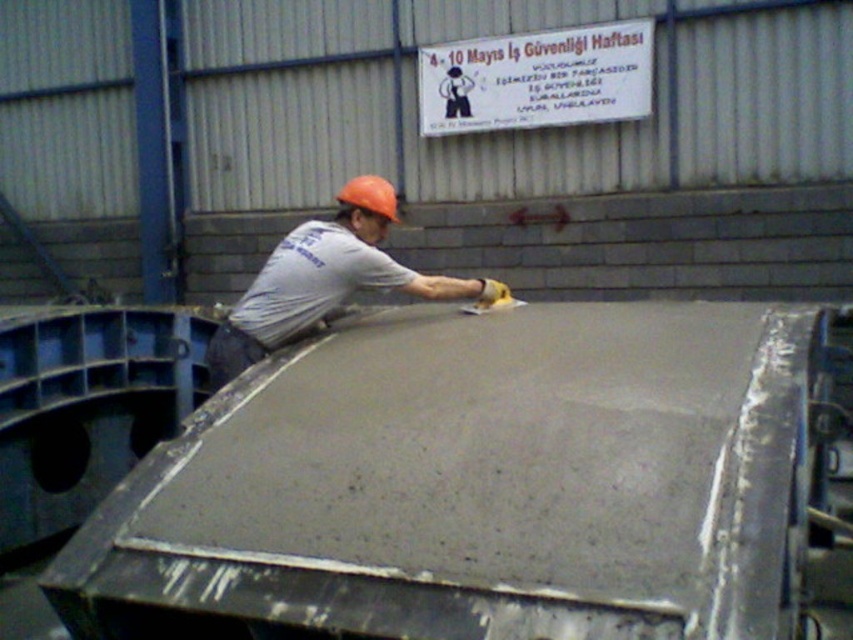
This screenshot has height=640, width=853. What do you see at coordinates (486, 483) in the screenshot?
I see `smooth concrete at center` at bounding box center [486, 483].

Between smooth concrete at center and matte gray shirt at center, which one appears on the left side from the viewer's perspective?

From the viewer's perspective, matte gray shirt at center appears more on the left side.

Is point (526, 365) positioned in front of point (345, 188)?

Yes.

This screenshot has height=640, width=853. I want to click on smooth concrete at center, so tap(486, 483).